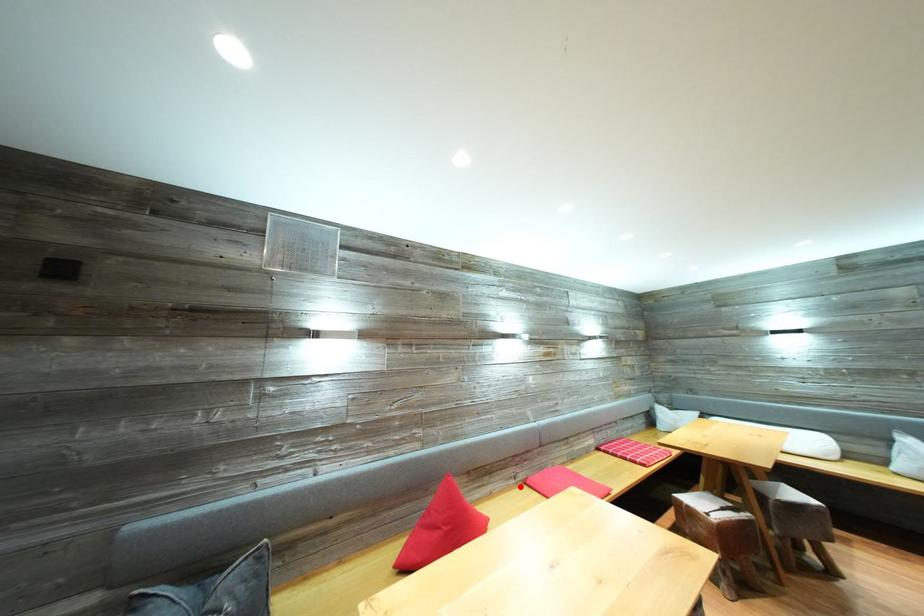
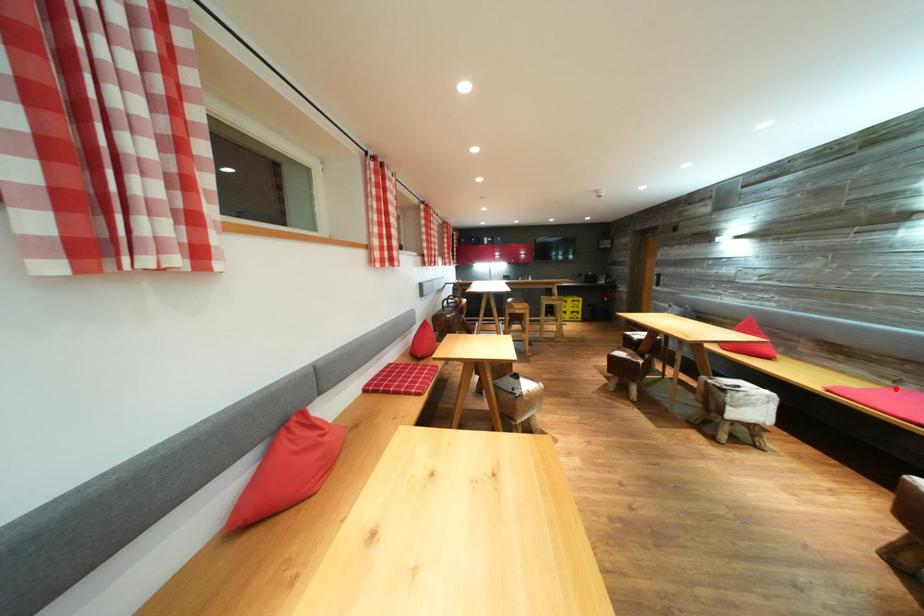
I am providing you with two images of the same scene from different viewpoints. A red point is marked on the first image and another point is marked on the second image. Does the point marked in image1 correspond to the same location as the one in image2?

Yes